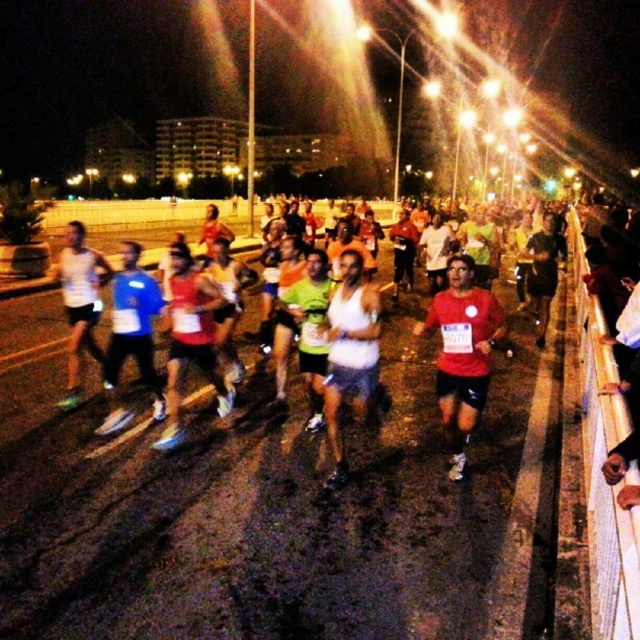
From the picture: Does red matte shirt at center come behind white matte tank top at center?

Yes, it is.

Between point (472, 394) and point (360, 340), which one is positioned behind?

The point (472, 394) is more distant.

Which is in front, point (484, 358) or point (355, 410)?

Point (484, 358)

Find the location of a particular element. red matte shirt at center is located at coordinates (461, 353).

Is point (243, 252) closer to viewer compared to point (456, 474)?

That is False.

Is white fabric tank top at center shorter than red matte shirt at center?

Incorrect, white fabric tank top at center's height does not fall short of red matte shirt at center's.

Is point (228, 376) farther from camera compared to point (445, 364)?

Yes, point (228, 376) is behind point (445, 364).

Identify the location of white fabric tank top at center. (125, 211).

Does white fabric tank top at center have a smaller size compared to white matte tank top at center?

No.

Between white fabric tank top at center and white matte tank top at center, which one has more height?

With more height is white fabric tank top at center.

Is point (472, 257) in front of point (349, 368)?

No, (472, 257) is further to viewer.

I want to click on white fabric tank top at center, so click(125, 211).